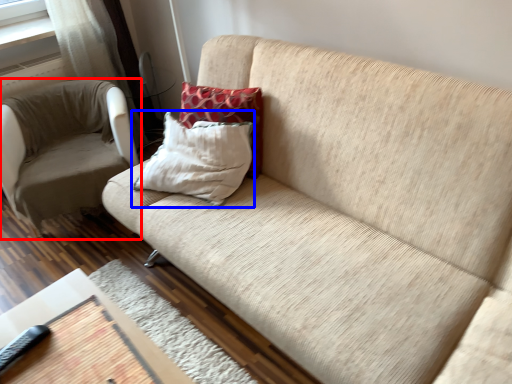
Question: Which of the following is the closest to the observer, chair (highlighted by a red box) or pillow (highlighted by a blue box)?

Choices:
 (A) chair
 (B) pillow

Answer: (B)